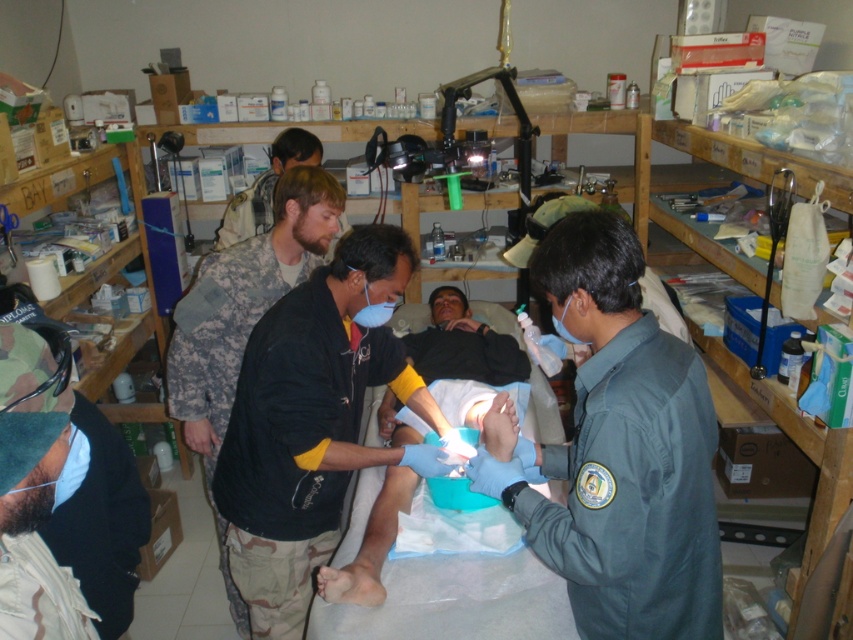
In the medical scene, there are two points marked as point 1 at coordinates (610, 577) and point 2 at (323, 193). From the perspective of someone observing the scene, which point is closer to the viewer?

Point 1 at coordinates (610, 577) is closer to the viewer because it is positioned in front of point 2 at (323, 193).